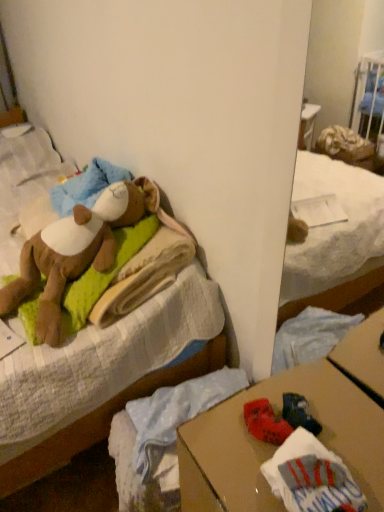
Question: Considering their positions, is soft plush bear at upper left located in front of or behind brown cardboard desk at lower right?

Choices:
 (A) behind
 (B) front

Answer: (A)

Question: Is soft plush bear at upper left spatially inside brown cardboard desk at lower right, or outside of it?

Choices:
 (A) inside
 (B) outside

Answer: (B)

Question: Considering the real-world distances, which object is closest to the soft plush bear at upper left?

Choices:
 (A) brown cardboard desk at lower right
 (B) soft brown teddy bear at upper left

Answer: (B)

Question: Estimate the real-world distances between objects in this image. Which object is farther from the soft plush bear at upper left?

Choices:
 (A) soft brown teddy bear at upper left
 (B) brown cardboard desk at lower right

Answer: (B)